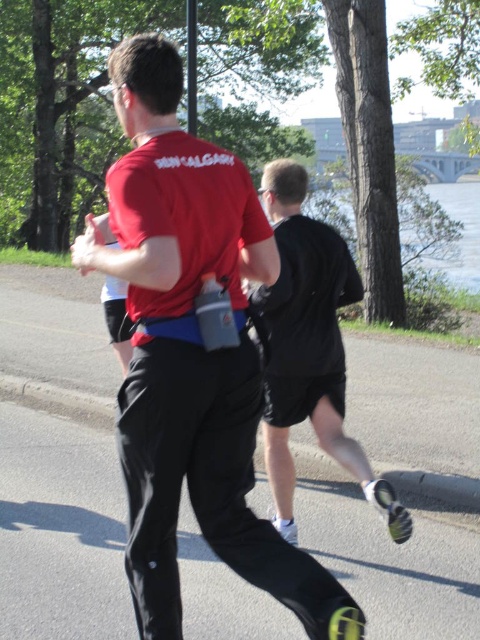
You are a photographer trying to capture a clear shot of the matte red shirt at center and the black matte shorts at center. Since both are in motion, you need to know if one is covering part of the other. Which object is blocking the view of the other?

The matte red shirt at center is positioned over black matte shorts at center, so the matte red shirt at center is blocking the view of the black matte shorts at center.

You are a photographer trying to capture a closeup of the matte red shirt at center and the black matte shorts at center. If your camera can only focus on objects wider than 15 inches, will both items be in focus?

The matte red shirt at center is wider than the black matte shorts at center. Since the camera focuses on objects wider than 15 inches, the matte red shirt at center will be in focus. However, the width of the black matte shorts at center is narrower than the shirt, so it might not meet the 15 inch requirement and may not be in focus.

Based on the scene description, where is the matte red shirt at center located in terms of coordinates?

The matte red shirt at center is located at coordinates point (192, 355).